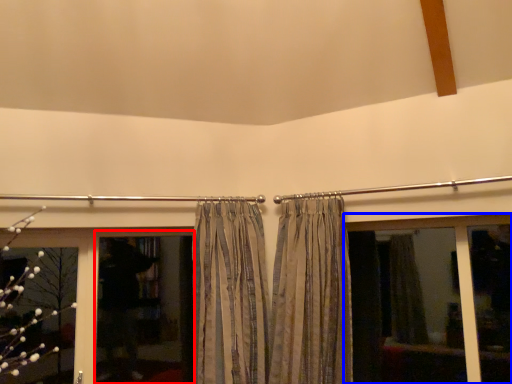
Question: Which point is closer to the camera, screen door (highlighted by a red box) or window (highlighted by a blue box)?

Choices:
 (A) screen door
 (B) window

Answer: (B)